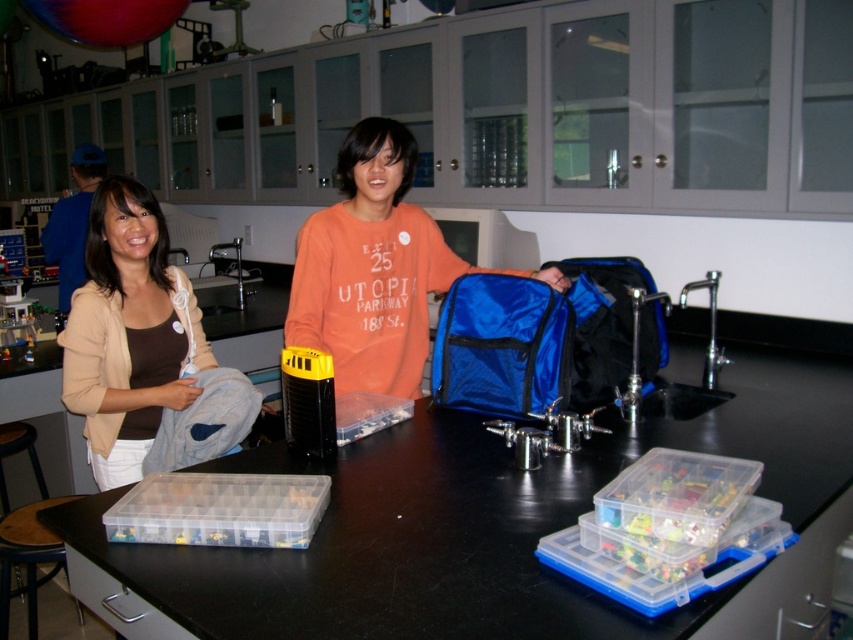
Is orange cotton shirt at center taller than wooden stool at lower left?

Indeed, orange cotton shirt at center has a greater height compared to wooden stool at lower left.

Measure the distance between point (396, 346) and camera.

Point (396, 346) is 2.17 meters from camera.

Where is `orange cotton shirt at center`? This screenshot has width=853, height=640. orange cotton shirt at center is located at coordinates (374, 268).

Can you confirm if clear plastic table at center is smaller than beige soft sweater at left?

No, clear plastic table at center is not smaller than beige soft sweater at left.

Which is more to the right, clear plastic table at center or beige soft sweater at left?

clear plastic table at center is more to the right.

Who is more forward, [572,493] or [154,435]?

Point [572,493]

Locate an element on the screen. This screenshot has width=853, height=640. clear plastic table at center is located at coordinates (474, 520).

Can you confirm if clear plastic table at center is positioned to the right of wooden stool at lower left?

Yes, clear plastic table at center is to the right of wooden stool at lower left.

Locate an element on the screen. clear plastic table at center is located at coordinates (474, 520).

The width and height of the screenshot is (853, 640). What do you see at coordinates (474, 520) in the screenshot? I see `clear plastic table at center` at bounding box center [474, 520].

Where is `clear plastic table at center`? The image size is (853, 640). clear plastic table at center is located at coordinates click(x=474, y=520).